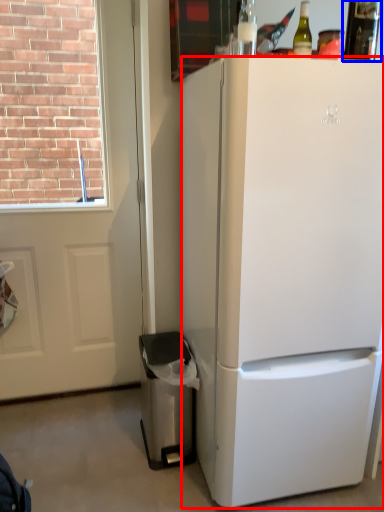
Question: Which object appears farthest to the camera in this image, refrigerator (highlighted by a red box) or bottle (highlighted by a blue box)?

Choices:
 (A) refrigerator
 (B) bottle

Answer: (B)